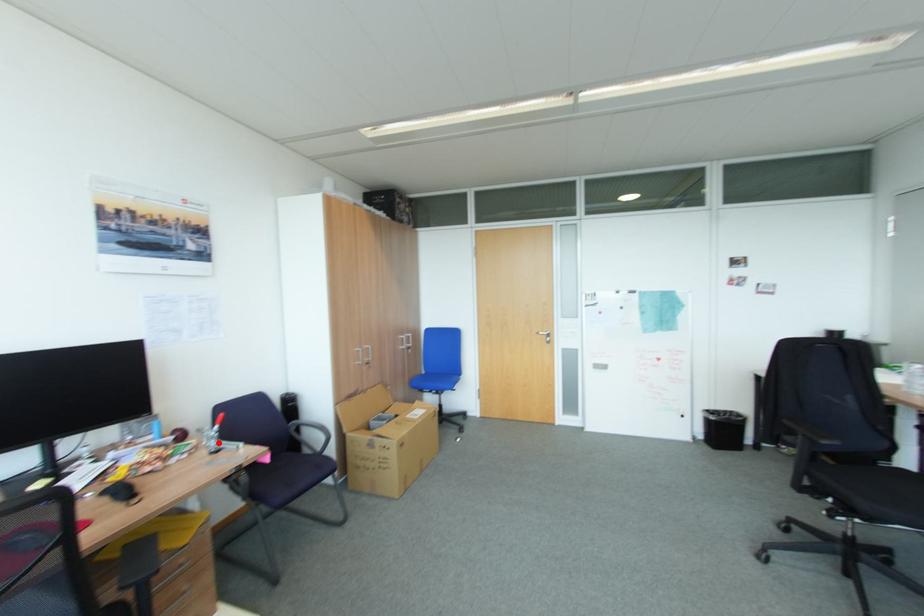
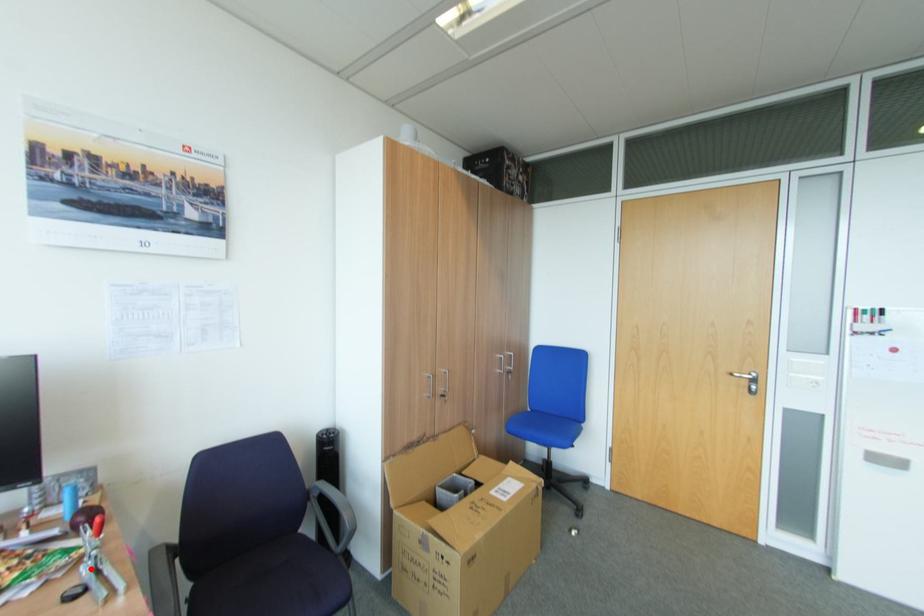
I am providing you with two images of the same scene from different viewpoints. A red point is marked on the first image and another point is marked on the second image. Is the red point in image1 aligned with the point shown in image2?

→ Yes